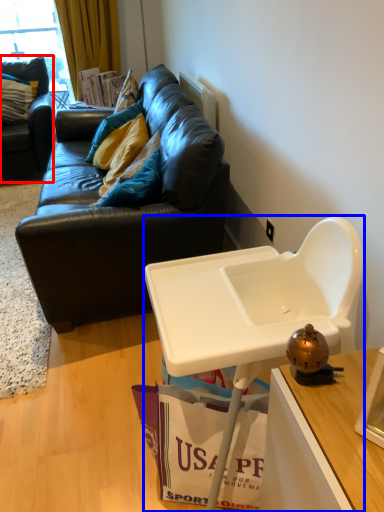
Question: Which object is further to the camera taking this photo, studio couch (highlighted by a red box) or table (highlighted by a blue box)?

Choices:
 (A) studio couch
 (B) table

Answer: (A)